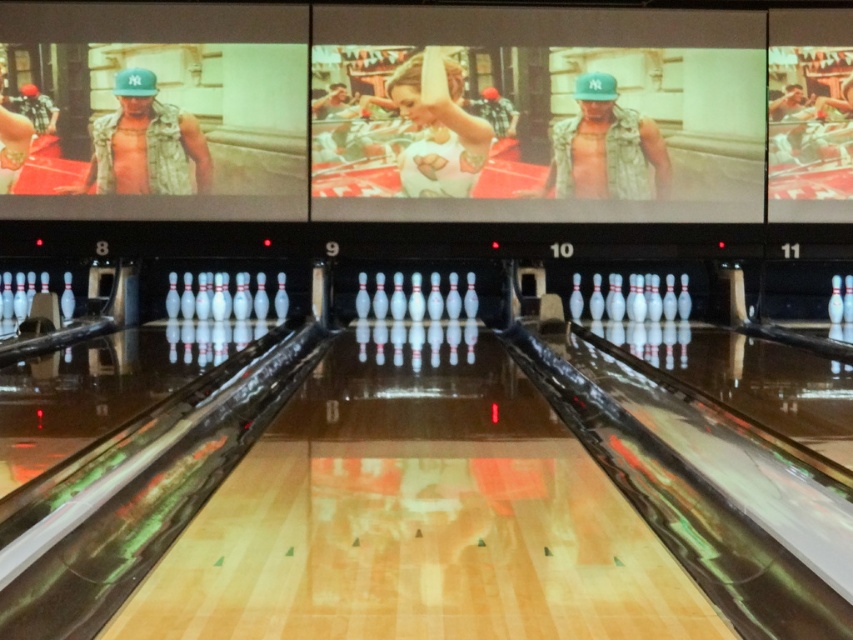
Question: Which of these objects is positioned farthest from the matte white dress at center?

Choices:
 (A) camouflage vest at center
 (B) camouflage sleeveless shirt at left

Answer: (B)

Question: Which point appears closest to the camera in this image?

Choices:
 (A) (10, 131)
 (B) (136, 70)
 (C) (427, 170)
 (D) (610, 132)

Answer: (A)

Question: Is camouflage sleeveless shirt at left to the right of matte white dress at center from the viewer's perspective?

Choices:
 (A) yes
 (B) no

Answer: (B)

Question: Considering the relative positions of camouflage vest at center and matte white dress at center in the image provided, where is camouflage vest at center located with respect to matte white dress at center?

Choices:
 (A) below
 (B) above

Answer: (A)

Question: Which object is positioned closest to the matte black vest at upper left?

Choices:
 (A) camouflage sleeveless shirt at left
 (B) camouflage vest at center

Answer: (A)

Question: Can you confirm if camouflage sleeveless shirt at left is wider than matte black vest at upper left?

Choices:
 (A) no
 (B) yes

Answer: (B)